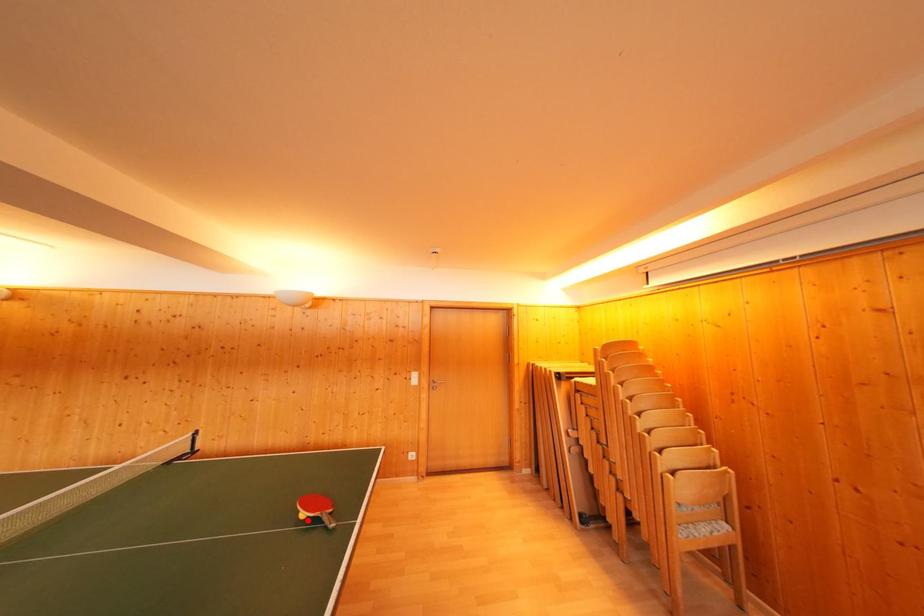
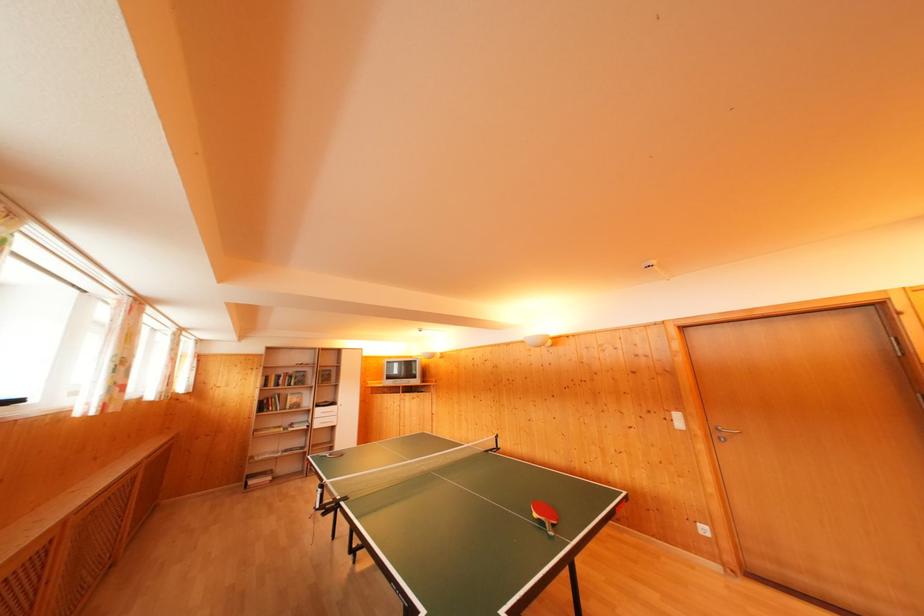
Question: I am providing you with two images of the same scene from different viewpoints. A red point is marked on the first image. Can you still see the location of the red point in image 2?

Choices:
 (A) Yes
 (B) No

Answer: (A)